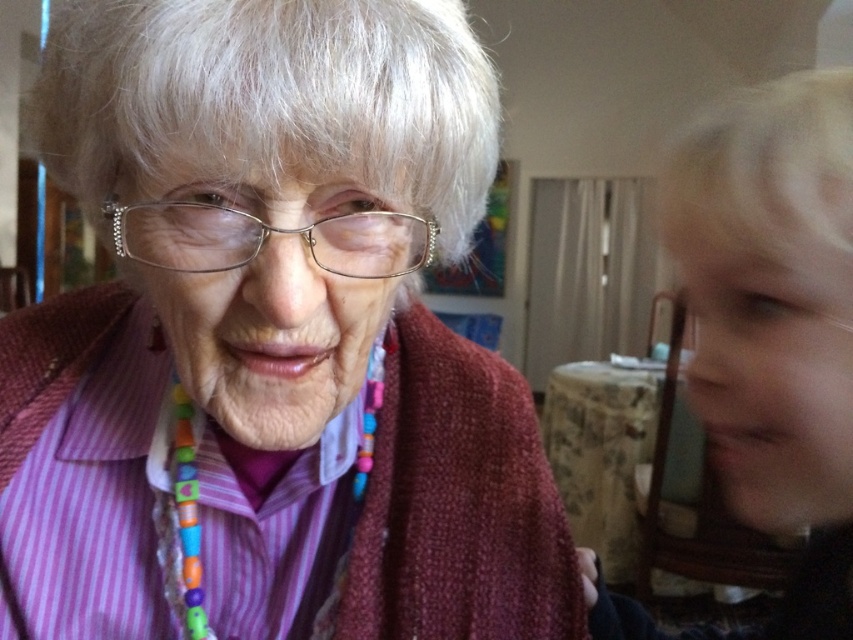
Does matte purple shirt at center have a lesser height compared to multicolored beaded necklace at right?

Yes.

Which is more to the right, matte purple shirt at center or multicolored beaded necklace at right?

From the viewer's perspective, multicolored beaded necklace at right appears more on the right side.

What are the coordinates of `matte purple shirt at center` in the screenshot? It's located at (271, 333).

Does matte purple shirt at center have a greater height compared to metallic frame glasses at center?

Yes.

Looking at this image, between matte purple shirt at center and metallic frame glasses at center, which one appears on the right side from the viewer's perspective?

metallic frame glasses at center

Find the location of a particular element. Image resolution: width=853 pixels, height=640 pixels. matte purple shirt at center is located at coordinates (271, 333).

Can you confirm if multicolored beaded necklace at right is positioned to the left of metallic frame glasses at center?

In fact, multicolored beaded necklace at right is to the right of metallic frame glasses at center.

Is point (846, 536) behind point (192, 234)?

Yes, point (846, 536) is farther from viewer.

I want to click on multicolored beaded necklace at right, so click(x=775, y=320).